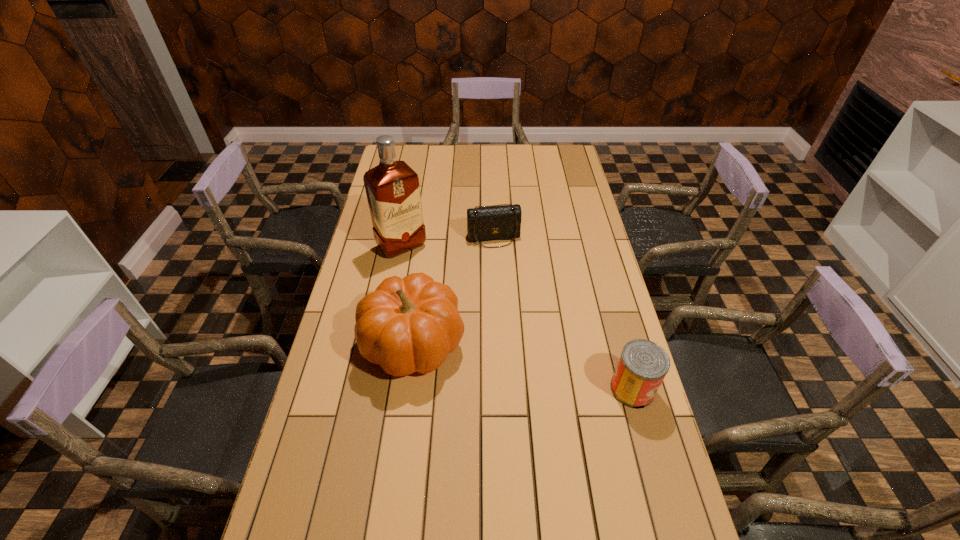
You are a GUI agent. You are given a task and a screenshot of the screen. Output one action in this format:
    pyautogui.click(x=<x>, y=<y>)
    Task: Click on the free space on the desktop that is between the third shortest object and the rightmost object and is positioned on the front label of the liquor
    
    Given the screenshot: What is the action you would take?
    pyautogui.click(x=495, y=360)

Where is `free space on the desktop that is between the pumpkin and the can and is positioned on the front flap of the shortest object`? free space on the desktop that is between the pumpkin and the can and is positioned on the front flap of the shortest object is located at coordinates (529, 367).